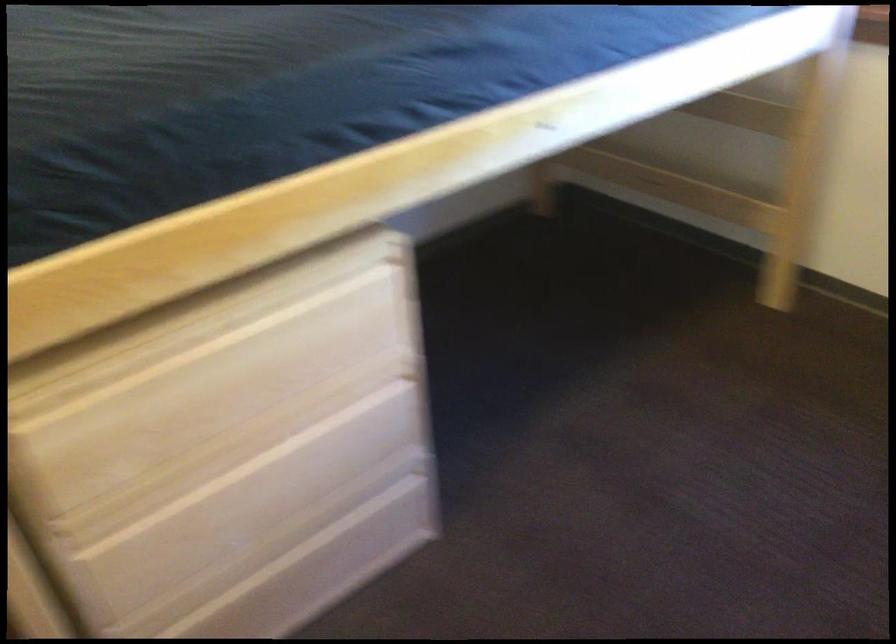
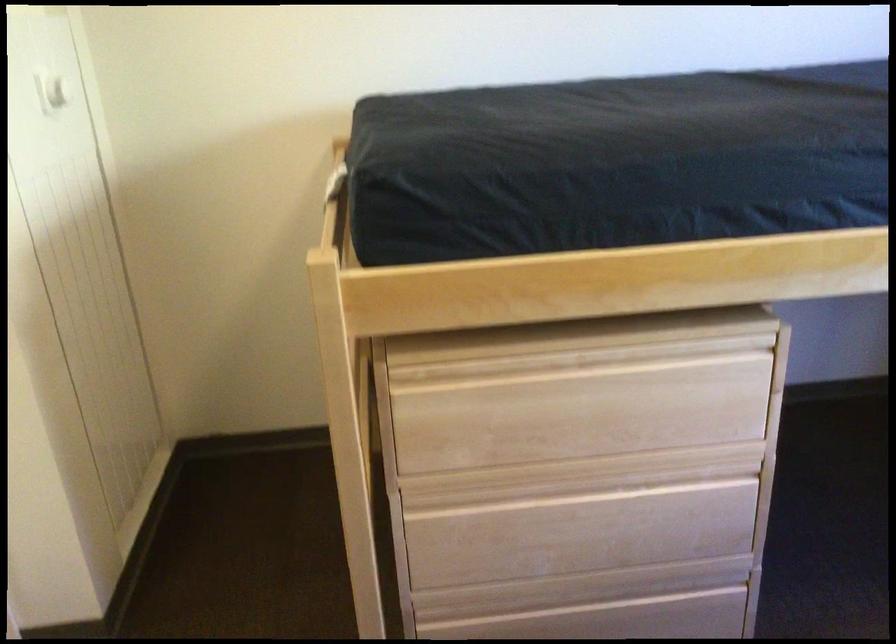
Locate, in the second image, the point that corresponds to (x=289, y=322) in the first image.

(642, 377)